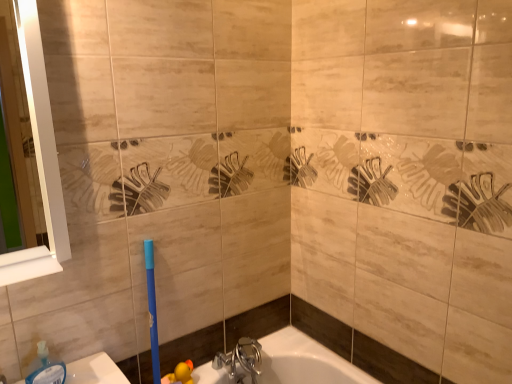
Question: In terms of width, does translucent plastic soap dispenser at lower left look wider or thinner when compared to chrome metallic faucet at lower center?

Choices:
 (A) wide
 (B) thin

Answer: (B)

Question: Is translucent plastic soap dispenser at lower left bigger or smaller than chrome metallic faucet at lower center?

Choices:
 (A) small
 (B) big

Answer: (A)

Question: Which of these objects is positioned closest to the chrome metallic faucet at lower center?

Choices:
 (A) translucent plastic soap dispenser at lower left
 (B) white glossy mirror at left

Answer: (A)

Question: Estimate the real-world distances between objects in this image. Which object is closer to the white glossy mirror at left?

Choices:
 (A) chrome metallic faucet at lower center
 (B) translucent plastic soap dispenser at lower left

Answer: (B)